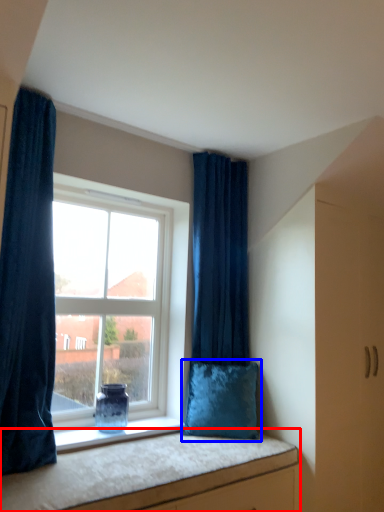
Question: Which object is further to the camera taking this photo, vanity (highlighted by a red box) or pillow (highlighted by a blue box)?

Choices:
 (A) vanity
 (B) pillow

Answer: (B)